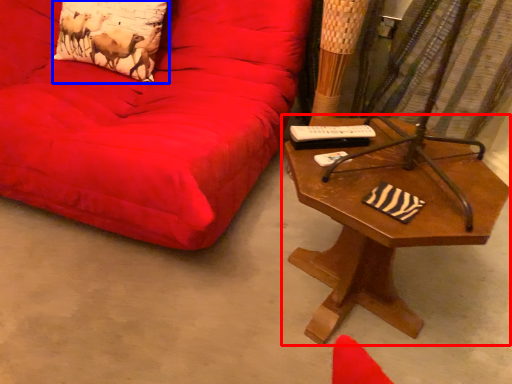
Question: Which object appears farthest to the camera in this image, table (highlighted by a red box) or pillow (highlighted by a blue box)?

Choices:
 (A) table
 (B) pillow

Answer: (B)